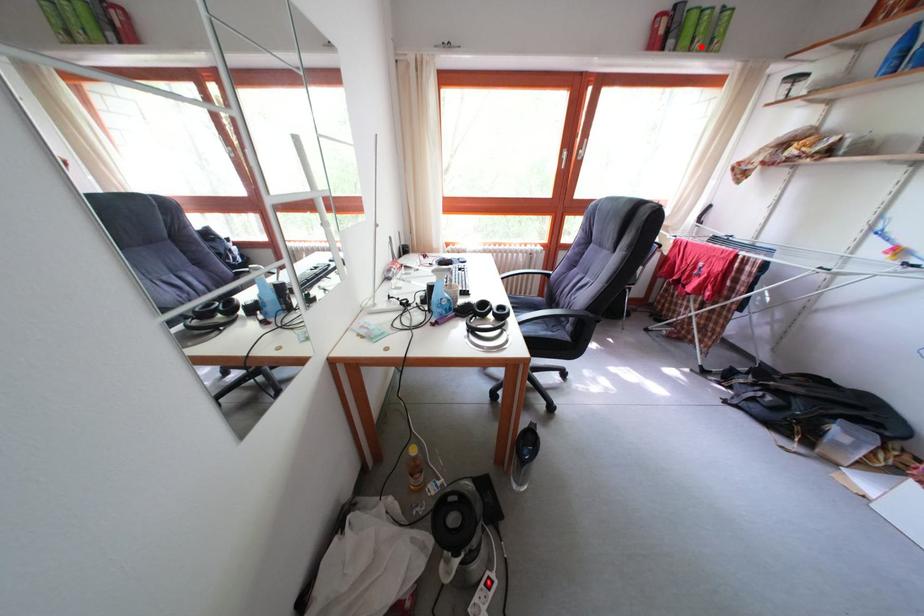
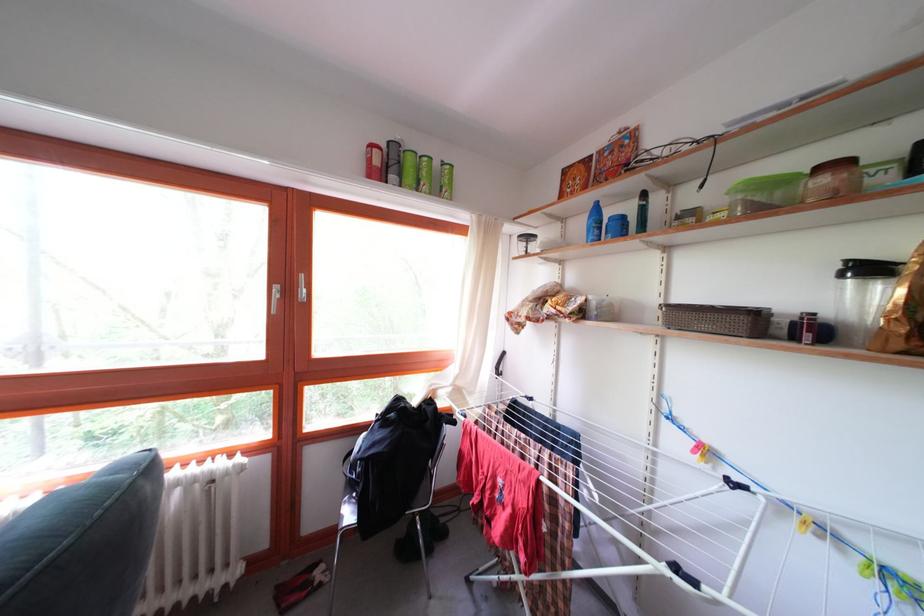
Question: A red point is marked in image1. In image2, is the corresponding 3D point closer to the camera or farther? Reply with the corresponding letter.

Choices:
 (A) The corresponding 3D point is closer.
 (B) The corresponding 3D point is farther.

Answer: (A)